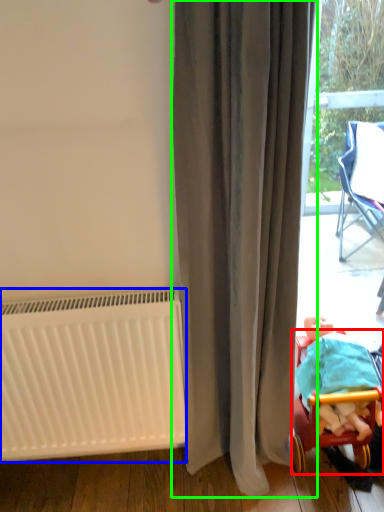
Question: Which object is positioned farthest from furniture (highlighted by a red box)? Select from radiator (highlighted by a blue box) and curtain (highlighted by a green box).

Choices:
 (A) radiator
 (B) curtain

Answer: (A)